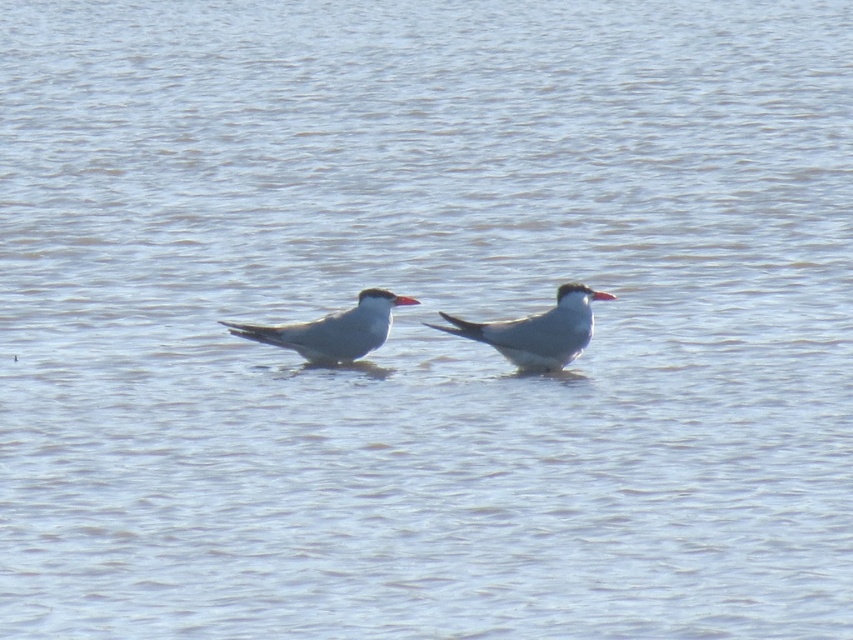
Is white glossy bird at center below red glossy beak at center?

Yes, white glossy bird at center is below red glossy beak at center.

Who is more distant from viewer, (590, 316) or (598, 292)?

The point (590, 316) is behind.

Locate an element on the screen. The height and width of the screenshot is (640, 853). white glossy bird at center is located at coordinates (535, 332).

Which is more to the right, white glossy bird at center or white glossy seagull at center?

Positioned to the right is white glossy bird at center.

Between point (485, 342) and point (384, 320), which one is positioned behind?

The point (384, 320) is behind.

Identify the location of white glossy bird at center. The height and width of the screenshot is (640, 853). tap(535, 332).

Is white glossy seagull at center to the left of matte red beak at center from the viewer's perspective?

Yes, white glossy seagull at center is to the left of matte red beak at center.

Locate an element on the screen. The height and width of the screenshot is (640, 853). white glossy seagull at center is located at coordinates (329, 330).